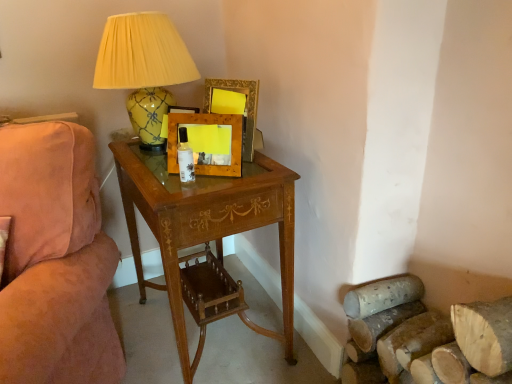
Question: Which direction should I rotate to look at wooden picture frame at center, marked as the 2th picture frame in a back-to-front arrangement?

Choices:
 (A) left
 (B) right

Answer: (A)

Question: Does suede pink couch at left turn towards wooden desk at center?

Choices:
 (A) no
 (B) yes

Answer: (A)

Question: Does suede pink couch at left lie in front of wooden desk at center?

Choices:
 (A) no
 (B) yes

Answer: (B)

Question: From a real-world perspective, is suede pink couch at left located beneath wooden desk at center?

Choices:
 (A) yes
 (B) no

Answer: (B)

Question: From a real-world perspective, is suede pink couch at left physically above wooden desk at center?

Choices:
 (A) no
 (B) yes

Answer: (B)

Question: Does suede pink couch at left appear on the right side of wooden desk at center?

Choices:
 (A) no
 (B) yes

Answer: (A)

Question: Is suede pink couch at left positioned with its back to wooden desk at center?

Choices:
 (A) yes
 (B) no

Answer: (B)

Question: From a real-world perspective, does yellow glossy ceramic lamp at upper left sit lower than wooden desk at center?

Choices:
 (A) yes
 (B) no

Answer: (B)

Question: Is yellow glossy ceramic lamp at upper left positioned before wooden desk at center?

Choices:
 (A) yes
 (B) no

Answer: (B)

Question: Considering the relative sizes of yellow glossy ceramic lamp at upper left and wooden desk at center in the image provided, is yellow glossy ceramic lamp at upper left thinner than wooden desk at center?

Choices:
 (A) yes
 (B) no

Answer: (A)

Question: Does yellow glossy ceramic lamp at upper left appear on the right side of wooden desk at center?

Choices:
 (A) no
 (B) yes

Answer: (A)

Question: Considering the relative sizes of yellow glossy ceramic lamp at upper left and wooden desk at center in the image provided, is yellow glossy ceramic lamp at upper left bigger than wooden desk at center?

Choices:
 (A) no
 (B) yes

Answer: (A)

Question: From the image's perspective, is yellow glossy ceramic lamp at upper left on top of wooden desk at center?

Choices:
 (A) no
 (B) yes

Answer: (B)

Question: Is wooden picture frame at center, marked as the 2th picture frame in a back-to-front arrangement, at the back of wooden desk at center?

Choices:
 (A) yes
 (B) no

Answer: (B)